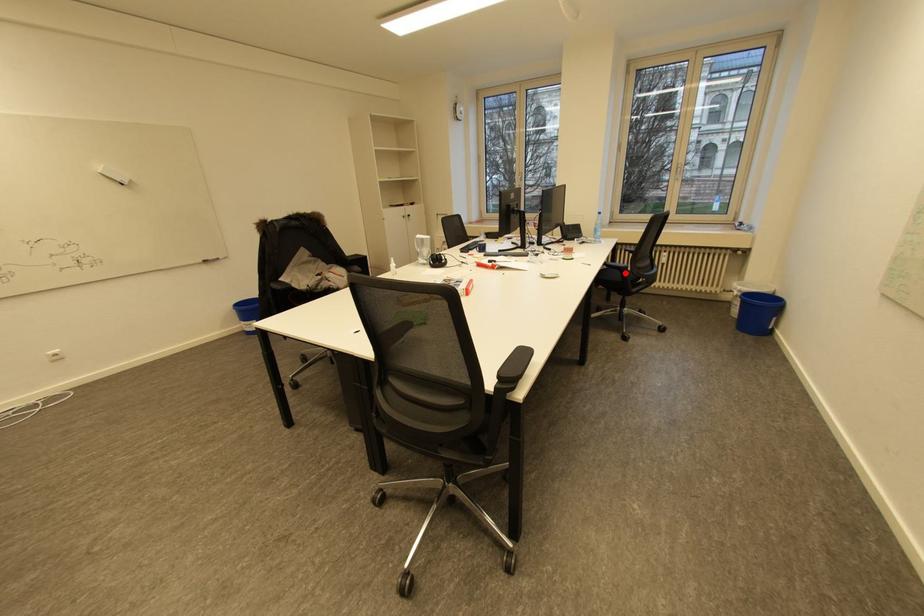
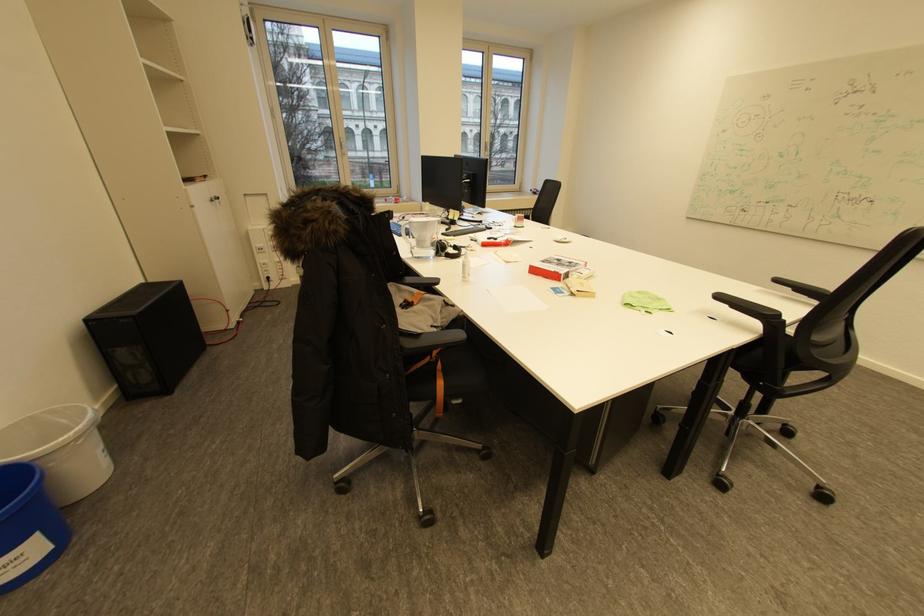
Question: I am providing you with two images of the same scene from different viewpoints. A red point is marked on the first image. Is the red point's position out of view in image 2?

Choices:
 (A) Yes
 (B) No

Answer: (A)